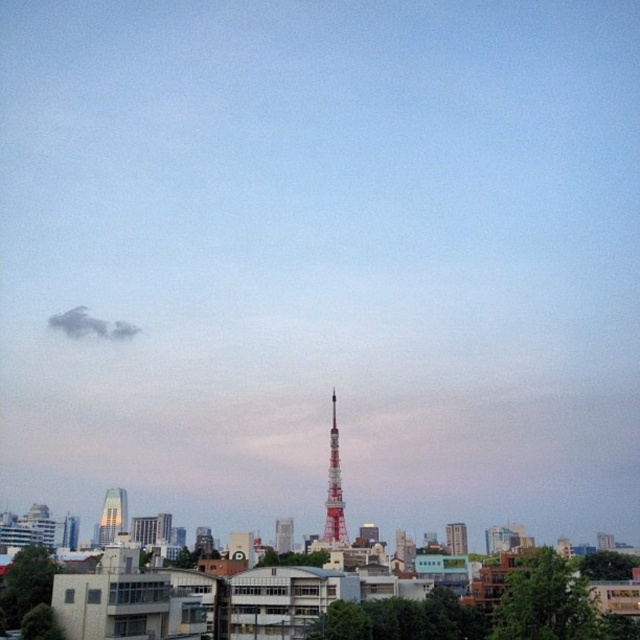
You are an architect analyzing the city skyline. Based on the image, which object is taller between the silver glass skyscraper at lower left and the white glossy tower at center?

The silver glass skyscraper at lower left is taller than the white glossy tower at center.

In the scene shown: You are a drone operator who needs to fly a drone to the exact location of the red painted metal tower at center. According to the coordinates provided, what are the coordinates you should input into the drone to reach the tower?

The coordinates to input into the drone to reach the red painted metal tower at center are point (333, 490).

You are an urban planner analyzing the city layout. Based on the scene, which object has a greater width between the silver glass skyscraper at lower left and the white glossy tower at center?

The silver glass skyscraper at lower left has a greater width than the white glossy tower at center according to the description.